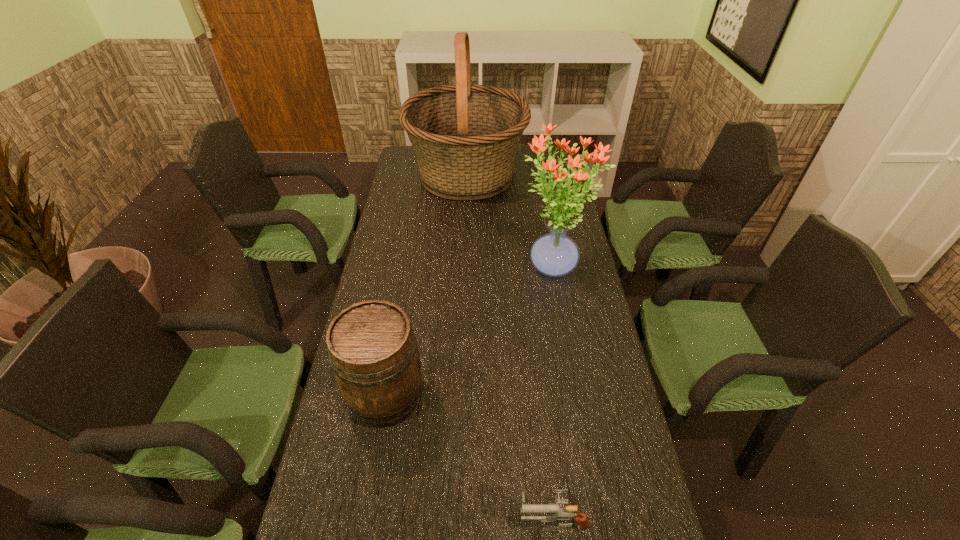
This screenshot has height=540, width=960. I want to click on basket, so click(465, 136).

Find the location of a particular element. the third shortest object is located at coordinates (555, 254).

The width and height of the screenshot is (960, 540). What are the coordinates of `the third nearest object` in the screenshot? It's located at (555, 254).

Locate an element on the screen. This screenshot has height=540, width=960. the third farthest object is located at coordinates (372, 349).

Where is `cider`? cider is located at coordinates (372, 349).

Image resolution: width=960 pixels, height=540 pixels. I want to click on vacant area situated 0.080m on the front of the farthest object, so [x=465, y=222].

Where is `free location located 0.380m on the left of the third nearest object`? Image resolution: width=960 pixels, height=540 pixels. free location located 0.380m on the left of the third nearest object is located at coordinates (404, 269).

Identify the location of free region located on the side of the second nearest object near the bung hole. (540, 397).

Find the location of a particular element. object that is at the far edge is located at coordinates (465, 136).

At what (x,y) coordinates should I click in order to perform the action: click on basket present at the left edge. Please return your answer as a coordinate pair (x, y). Image resolution: width=960 pixels, height=540 pixels. Looking at the image, I should click on (465, 136).